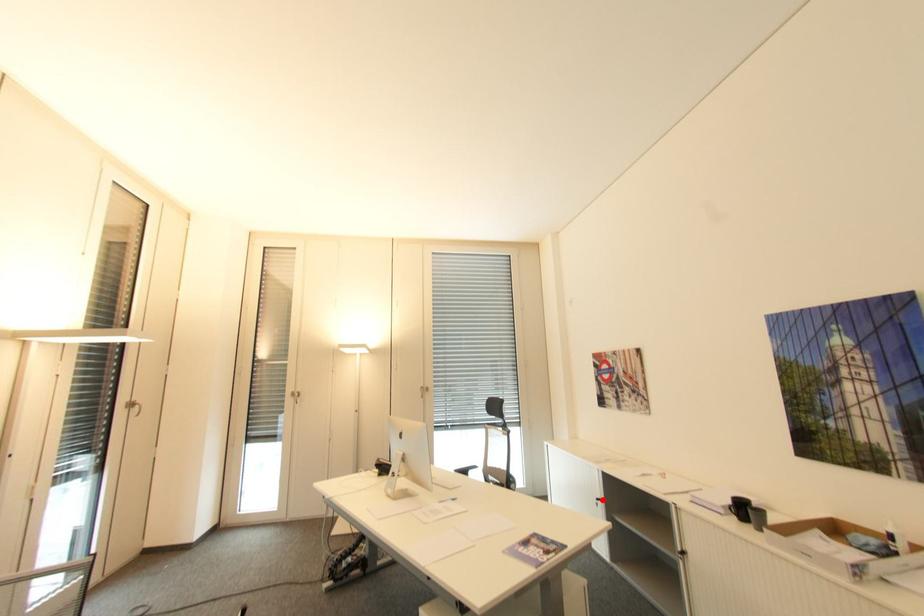
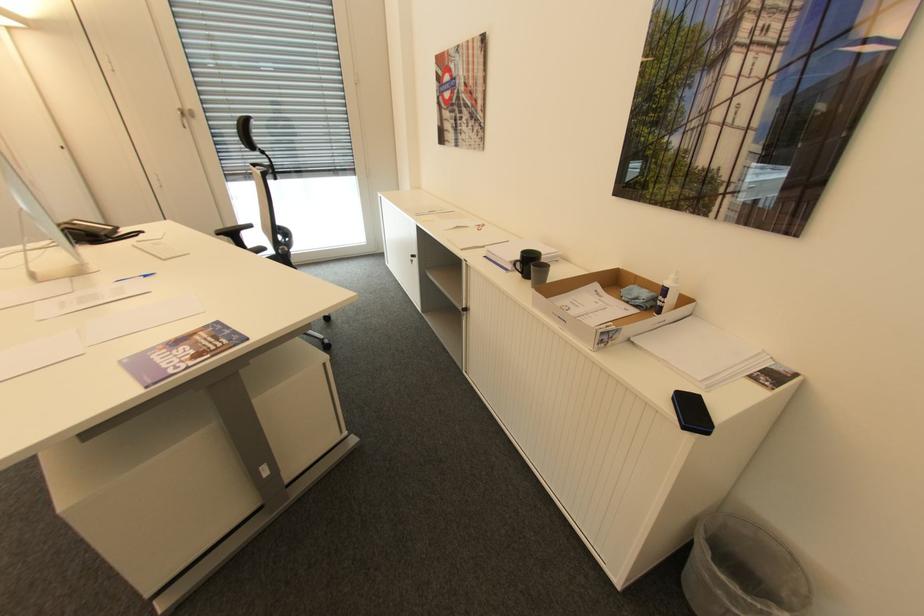
Question: I am providing you with two images of the same scene from different viewpoints. Given a red point in image1, look at the same physical point in image2. Is it:

Choices:
 (A) Closer to the viewpoint
 (B) Farther from the viewpoint

Answer: (A)